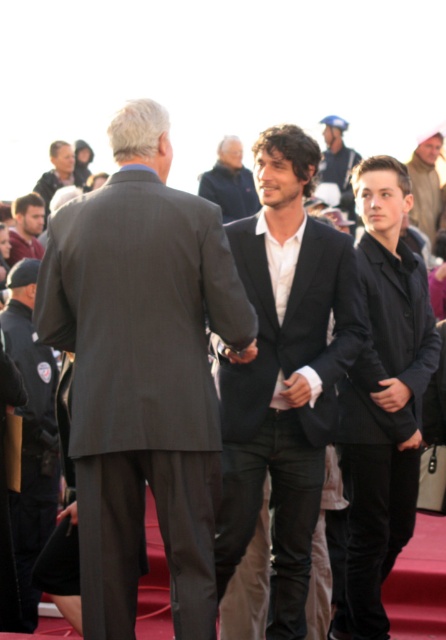
Is dark gray suit at center shorter than blue denim jeans at upper center?

Incorrect, dark gray suit at center's height does not fall short of blue denim jeans at upper center's.

Does dark gray suit at center appear on the left side of blue denim jeans at upper center?

Indeed, dark gray suit at center is positioned on the left side of blue denim jeans at upper center.

Who is more distant from viewer, (x=188, y=353) or (x=334, y=125)?

The point (x=334, y=125) is behind.

Find the location of a particular element. The image size is (446, 640). dark gray suit at center is located at coordinates (143, 372).

Consider the image. Which of these two, matte black suit at center or dark blue jacket at center, stands shorter?

dark blue jacket at center is shorter.

Can you confirm if matte black suit at center is thinner than dark blue jacket at center?

No.

Measure the distance between matte black suit at center and camera.

They are 45.40 feet apart.

Where is `matte black suit at center`? This screenshot has height=640, width=446. matte black suit at center is located at coordinates (284, 372).

Is point (247, 289) farther from viewer compared to point (41, 177)?

That is False.

Is point (263, 369) closer to viewer compared to point (46, 172)?

Yes, point (263, 369) is in front of point (46, 172).

Image resolution: width=446 pixels, height=640 pixels. What are the coordinates of `matte black suit at center` in the screenshot? It's located at (284, 372).